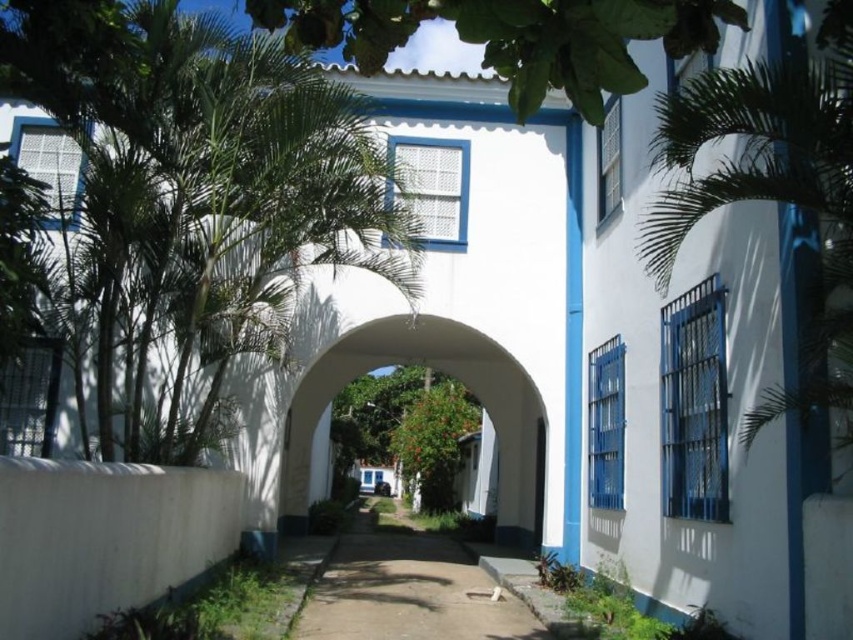
Question: From the image, what is the correct spatial relationship of green leafy tree at upper center in relation to green leafy tree at center?

Choices:
 (A) right
 (B) left

Answer: (A)

Question: Is green leafy tree at upper center bigger than brown dirt path at center?

Choices:
 (A) yes
 (B) no

Answer: (B)

Question: Estimate the real-world distances between objects in this image. Which object is farther from the green leafy tree at upper center?

Choices:
 (A) green leafy tree at center
 (B) green leafy palm tree at left
 (C) green leafy palm at right

Answer: (A)

Question: Is green leafy palm at right to the right of white smooth archway at center from the viewer's perspective?

Choices:
 (A) no
 (B) yes

Answer: (B)

Question: Which of the following is the farthest from the observer?

Choices:
 (A) green leafy tree at center
 (B) green leafy palm tree at left
 (C) white smooth archway at center

Answer: (A)

Question: Which object appears farthest from the camera in this image?

Choices:
 (A) green leafy palm at right
 (B) green leafy palm tree at left
 (C) white smooth archway at center

Answer: (C)